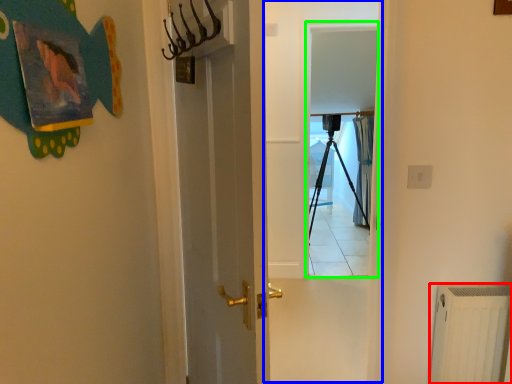
Question: Based on their relative distances, which object is nearer to radiator (highlighted by a red box)? Choose from screen door (highlighted by a blue box) and screen door (highlighted by a green box).

Choices:
 (A) screen door
 (B) screen door

Answer: (A)